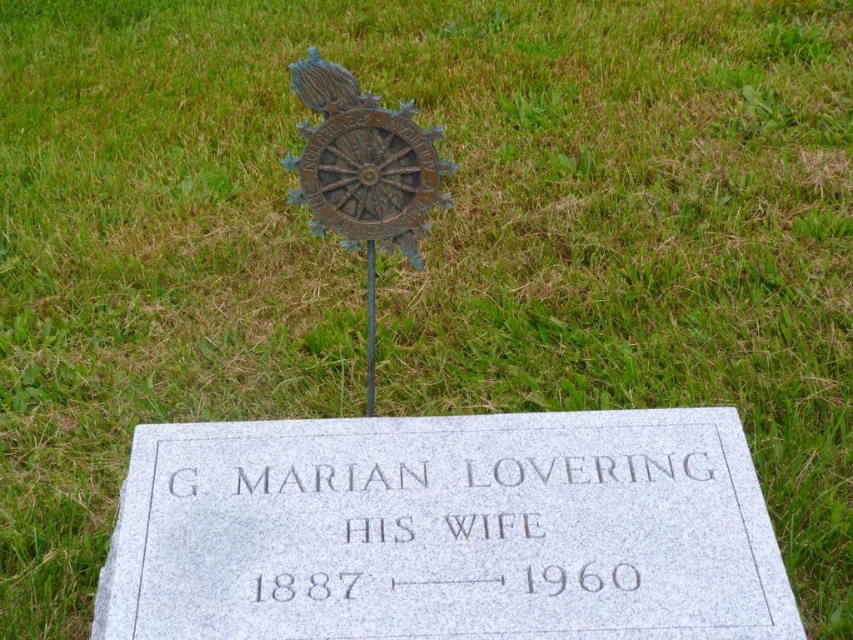
The height and width of the screenshot is (640, 853). What do you see at coordinates (445, 531) in the screenshot?
I see `granite at center` at bounding box center [445, 531].

Which is behind, point (743, 604) or point (367, 332)?

Point (367, 332)

Where is `granite at center`? This screenshot has height=640, width=853. granite at center is located at coordinates (445, 531).